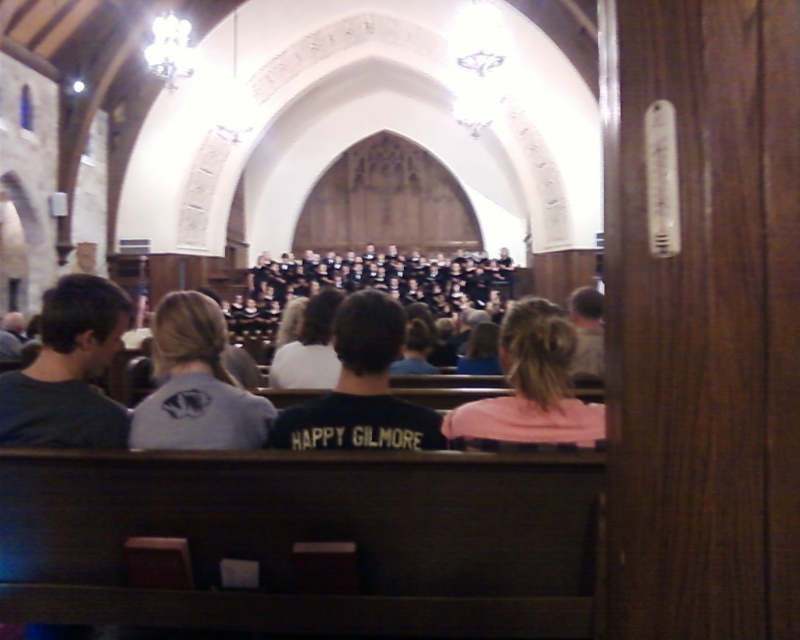
Question: Which point is farther to the camera?

Choices:
 (A) dark gray t-shirt at left
 (B) black matte shirt at center
 (C) dark gray sweater at center
 (D) pink fabric hair at center

Answer: (B)

Question: Which object is positioned farthest from the dark gray t-shirt at left?

Choices:
 (A) pink fabric hair at center
 (B) black matte shirt at center

Answer: (A)

Question: Observing the image, what is the correct spatial positioning of dark gray sweater at center in reference to black matte shirt at center?

Choices:
 (A) right
 (B) left

Answer: (B)

Question: Does black matte shirt at center appear on the left side of pink fabric hair at center?

Choices:
 (A) yes
 (B) no

Answer: (A)

Question: Is dark gray t-shirt at left further to camera compared to dark gray sweater at center?

Choices:
 (A) no
 (B) yes

Answer: (A)

Question: Which is farther from the dark gray t-shirt at left?

Choices:
 (A) dark gray sweater at center
 (B) black matte shirt at center
 (C) pink fabric hair at center

Answer: (C)